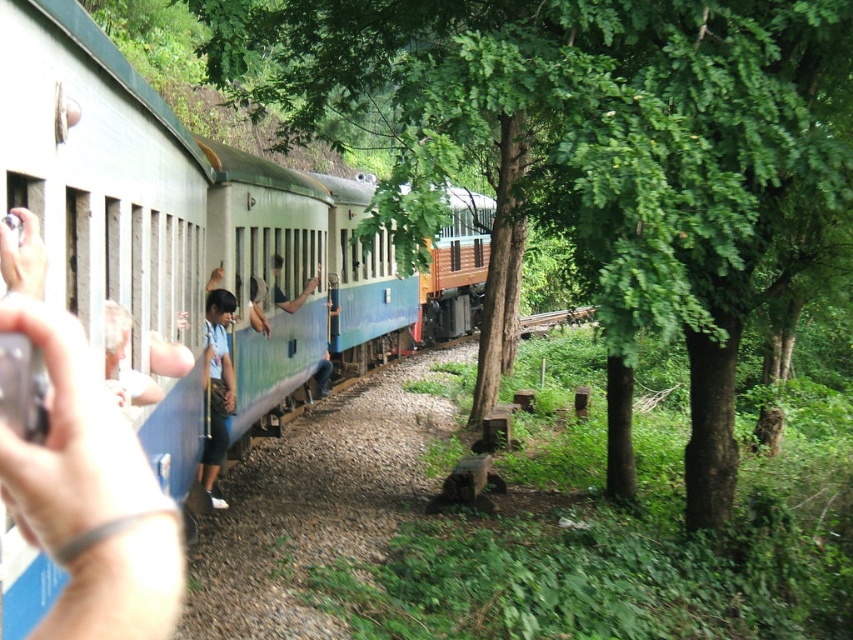
Question: Which point is farther to the camera?

Choices:
 (A) blue fabric shirt at left
 (B) blue painted metal train at center
 (C) green leafy tree at center

Answer: (A)

Question: Observing the image, what is the correct spatial positioning of green leafy tree at center in reference to blue fabric shirt at left?

Choices:
 (A) below
 (B) above

Answer: (B)

Question: Is blue painted metal train at center closer to the viewer compared to blue fabric shirt at left?

Choices:
 (A) yes
 (B) no

Answer: (A)

Question: Which of these objects is positioned closest to the blue painted metal train at center?

Choices:
 (A) blue fabric shirt at left
 (B) green leafy tree at center

Answer: (A)

Question: Considering the relative positions of blue painted metal train at center and blue fabric shirt at left in the image provided, where is blue painted metal train at center located with respect to blue fabric shirt at left?

Choices:
 (A) above
 (B) below

Answer: (A)

Question: Estimate the real-world distances between objects in this image. Which object is farther from the blue fabric shirt at left?

Choices:
 (A) blue painted metal train at center
 (B) green leafy tree at center

Answer: (B)